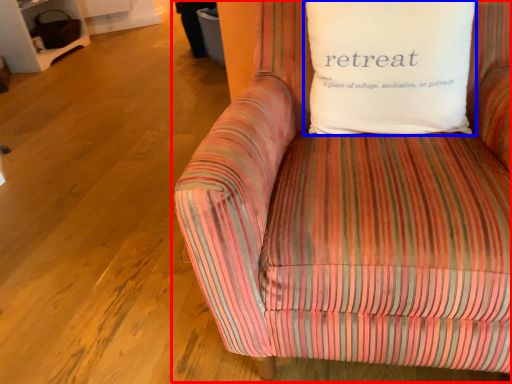
Question: Which of the following is the farthest to the observer, studio couch (highlighted by a red box) or pillow (highlighted by a blue box)?

Choices:
 (A) studio couch
 (B) pillow

Answer: (B)